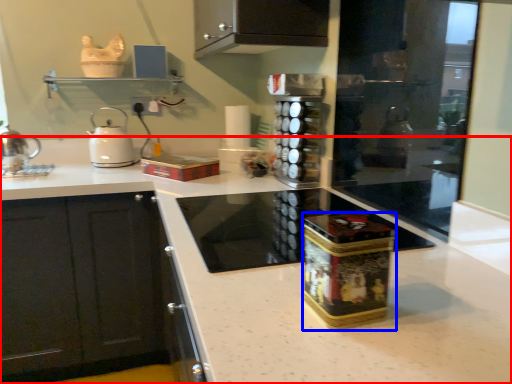
Question: Which of the following is the farthest to the observer, countertop (highlighted by a red box) or appliance (highlighted by a blue box)?

Choices:
 (A) countertop
 (B) appliance

Answer: (B)